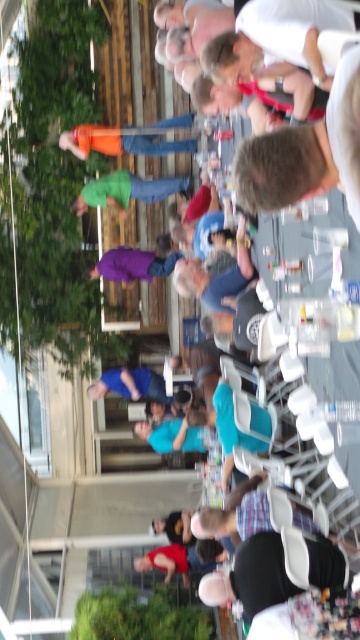
Who is more forward, (312, 148) or (162, 390)?

Point (312, 148) is more forward.

Is point (251, 189) positioned after point (149, 372)?

No, it is not.

Between point (340, 67) and point (141, 378), which one is positioned behind?

The point (141, 378) is more distant.

Find the location of a particular element. The width and height of the screenshot is (360, 640). gray fabric shirt at upper center is located at coordinates pyautogui.click(x=303, y=154).

Is gray fabric shirt at upper center further to the viewer compared to purple fabric pants at center?

No.

Who is taller, gray fabric shirt at upper center or purple fabric pants at center?

With more height is gray fabric shirt at upper center.

Does point (236, 168) come farther from viewer compared to point (159, 262)?

No, it is not.

What are the coordinates of `gray fabric shirt at upper center` in the screenshot? It's located at (303, 154).

Between point (120, 182) and point (177, 570), which one is positioned behind?

Point (120, 182)

Does green matte shirt at center lie in front of red shirt at lower center?

No, it is behind red shirt at lower center.

Does point (160, 182) lie behind point (186, 554)?

That is True.

This screenshot has width=360, height=640. I want to click on green matte shirt at center, so click(124, 189).